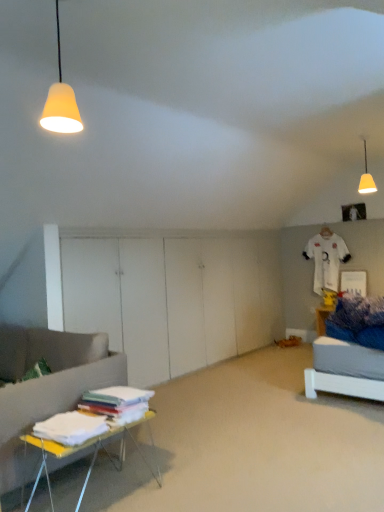
You are a GUI agent. You are given a task and a screenshot of the screen. Output one action in this format:
    pyautogui.click(x=<x>, y=<y>)
    Task: Click on the vacant space to the right of white plastic table at lower left
    Image resolution: width=384 pixels, height=512 pixels.
    Given the screenshot: What is the action you would take?
    pyautogui.click(x=206, y=476)